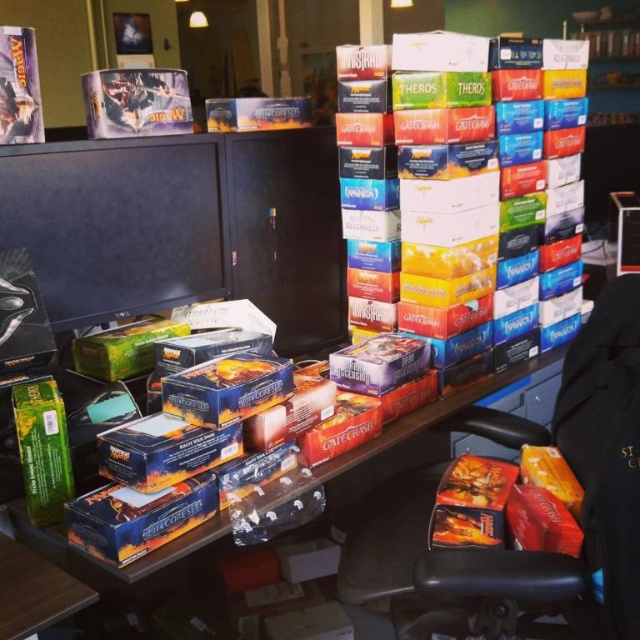
You are organizing a Magic card event and need to move the black plastic swivel chair at lower right. Can you place it next to the matte cardboard boxes at center without moving the boxes?

The black plastic swivel chair at lower right is smaller than the matte cardboard boxes at center. Since it is smaller, you can place it next to the matte cardboard boxes at center without needing to move them.

You are organizing a Magic card event and need to move the black plastic swivel chair at lower right to make space for attendees. Which direction should you move it relative to the matte cardboard boxes at center?

The black plastic swivel chair at lower right is positioned on the right side of matte cardboard boxes at center, so moving it further to the right would keep it away from the boxes. Alternatively, moving it to the left would place it closer to the boxes. However, since the goal is to create space, moving it to the right away from the boxes would be more effective.

You are organizing a Magic card event and need to move the black plastic swivel chair at lower right to make space. Based on its current position, which area of the desk would be cleared if you move it?

The area at point [513,548] would be cleared if you move the black plastic swivel chair at lower right, as that is its current location.